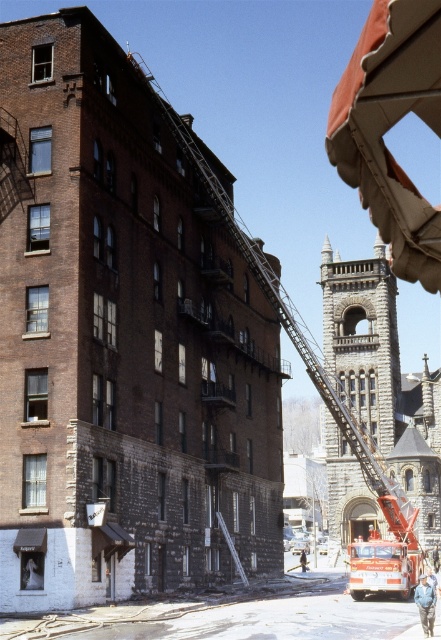
Which is in front, point (254, 273) or point (302, 556)?

Point (254, 273) is more forward.

Is red metallic fire truck at right in front of dark blue jeans at center?

Yes, it is.

Between point (205, 161) and point (303, 554), which one is positioned in front?

Positioned in front is point (205, 161).

You are a GUI agent. You are given a task and a screenshot of the screen. Output one action in this format:
    pyautogui.click(x=<x>, y=<y>)
    Task: Click on the red metallic fire truck at right
    
    Given the screenshot: What is the action you would take?
    pyautogui.click(x=295, y=332)

Does red metallic fire truck at right come in front of light blue denim jacket at lower right?

Yes, it is in front of light blue denim jacket at lower right.

Looking at this image, is red metallic fire truck at right taller than light blue denim jacket at lower right?

Correct, red metallic fire truck at right is much taller as light blue denim jacket at lower right.

Which is in front, point (388, 483) or point (433, 566)?

Point (388, 483) is in front.

The width and height of the screenshot is (441, 640). Identify the location of red metallic fire truck at right. (295, 332).

Which is in front, point (324, 396) or point (243, 577)?

Point (243, 577)

Is red metallic fire truck at right shorter than metallic silver ladder at center?

Incorrect, red metallic fire truck at right's height does not fall short of metallic silver ladder at center's.

Between point (310, 364) and point (231, 547), which one is positioned in front?

Point (231, 547)

You are a GUI agent. You are given a task and a screenshot of the screen. Output one action in this format:
    pyautogui.click(x=<x>, y=<y>)
    Task: Click on the red metallic fire truck at right
    
    Given the screenshot: What is the action you would take?
    pyautogui.click(x=295, y=332)